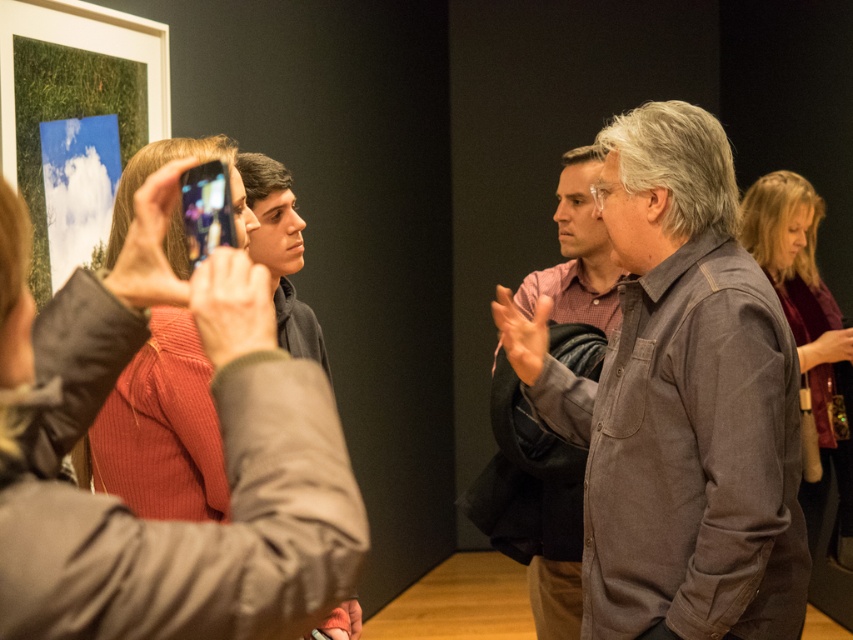
Can you confirm if brown cotton shirt at center is positioned to the right of ribbed sweater at center?

Indeed, brown cotton shirt at center is positioned on the right side of ribbed sweater at center.

Between brown cotton shirt at center and ribbed sweater at center, which one is positioned lower?

brown cotton shirt at center is below.

The height and width of the screenshot is (640, 853). In order to click on brown cotton shirt at center in this screenshot , I will do `click(679, 401)`.

Can you confirm if brown cotton shirt at center is wider than maroon velvet blouse at right?

No.

Between brown cotton shirt at center and maroon velvet blouse at right, which one is positioned lower?

maroon velvet blouse at right is lower down.

Which is in front, point (788, 339) or point (805, 202)?

Point (788, 339) is more forward.

This screenshot has height=640, width=853. Find the location of `brown cotton shirt at center`. brown cotton shirt at center is located at coordinates (679, 401).

Between point (538, 492) and point (802, 500), which one is positioned in front?

Positioned in front is point (538, 492).

Is point (561, 513) farther from viewer compared to point (787, 211)?

No.

At what (x,y) coordinates should I click in order to perform the action: click on denim shirt at center. Please return your answer as a coordinate pair (x, y). Looking at the image, I should click on [x=577, y=253].